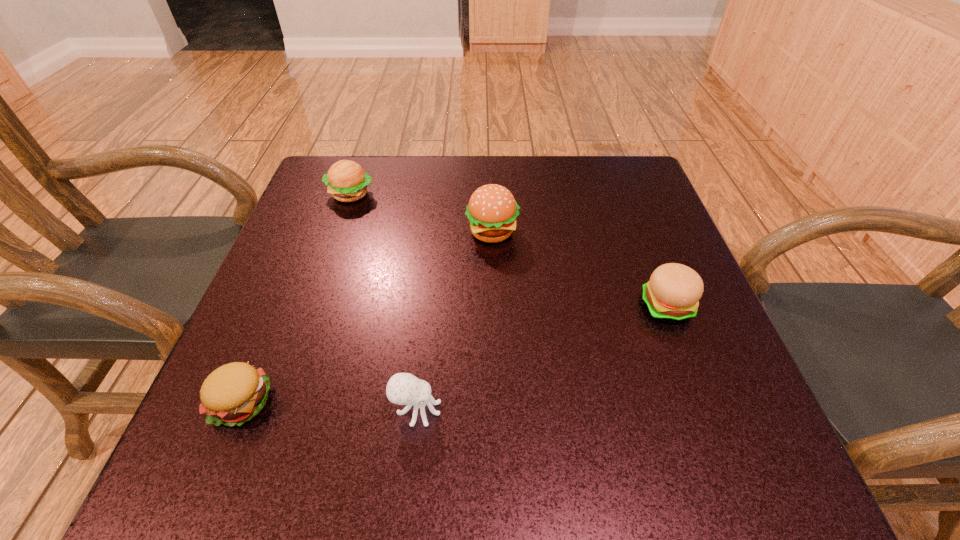
Find the location of a particular element. The height and width of the screenshot is (540, 960). vacant region located 0.120m on the front of the rightmost object is located at coordinates (697, 385).

Find the location of a particular element. vacant space located on the front-facing side of the third object from right to left is located at coordinates (531, 409).

Find the location of a particular element. This screenshot has width=960, height=540. blank space located 0.190m on the back of the nearest hamburger is located at coordinates (287, 291).

Locate an element on the screen. The image size is (960, 540). object that is at the far edge is located at coordinates (347, 182).

The image size is (960, 540). I want to click on octopus present at the near edge, so click(403, 388).

Locate an element on the screen. hamburger situated at the near edge is located at coordinates (234, 393).

This screenshot has width=960, height=540. What are the coordinates of `object at the right edge` in the screenshot? It's located at (674, 290).

I want to click on object present at the far left corner, so click(347, 182).

Find the location of a particular element. object at the near left corner is located at coordinates (234, 393).

The height and width of the screenshot is (540, 960). In the image, there is a desktop. What are the coordinates of `vacant space at the far edge` in the screenshot? It's located at (492, 181).